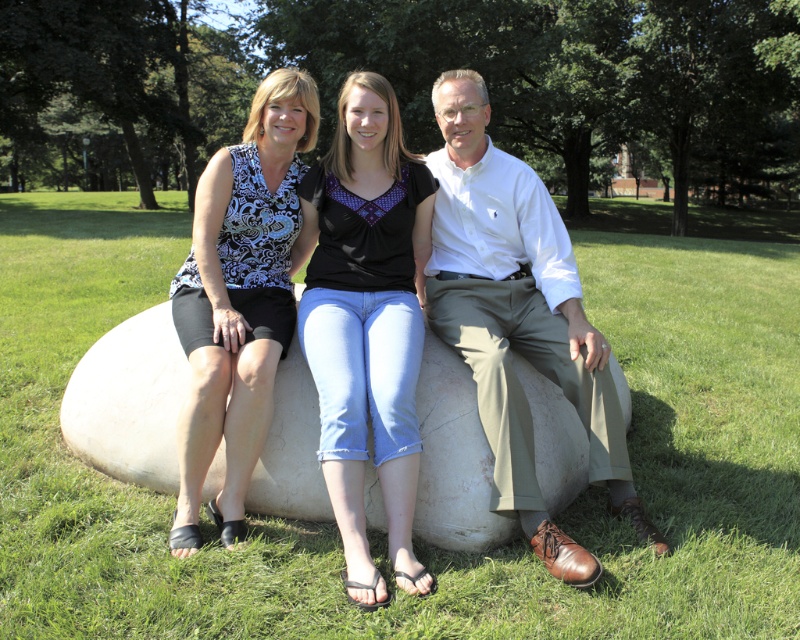
You are standing in a park and see the white smooth boulder at center. If you want to locate it precisely, what are its coordinates?

The white smooth boulder at center is located at coordinates point (130,401).

You are a photographer setting up a tripod to capture the scene. The white smooth boulder at center and the denim jeans at center are both in your viewfinder. Based on their sizes, which object should you focus on first if you want to ensure both are in focus?

The white smooth boulder at center is larger in size than denim jeans at center, so focusing on the larger object first would help ensure both are in focus.

You are taking a photo of the three people sitting on the stone sculpture. You want to focus on the person closest to the camera. Which point should you focus on, point (x=98, y=240) or point (x=518, y=388)?

Point (x=98, y=240) is further to the camera than point (x=518, y=388), so you should focus on point (x=98, y=240) to capture the person closest to the camera.